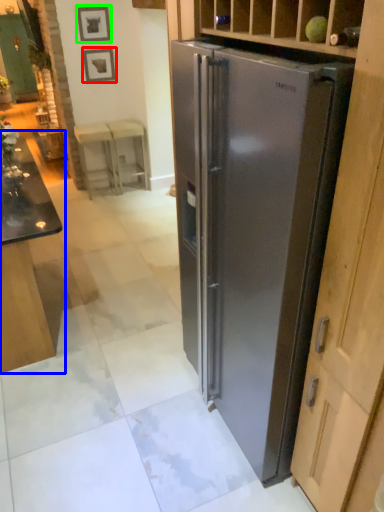
Question: Considering the real-world distances, which object is closest to picture frame (highlighted by a red box)? table (highlighted by a blue box) or picture frame (highlighted by a green box).

Choices:
 (A) table
 (B) picture frame

Answer: (B)